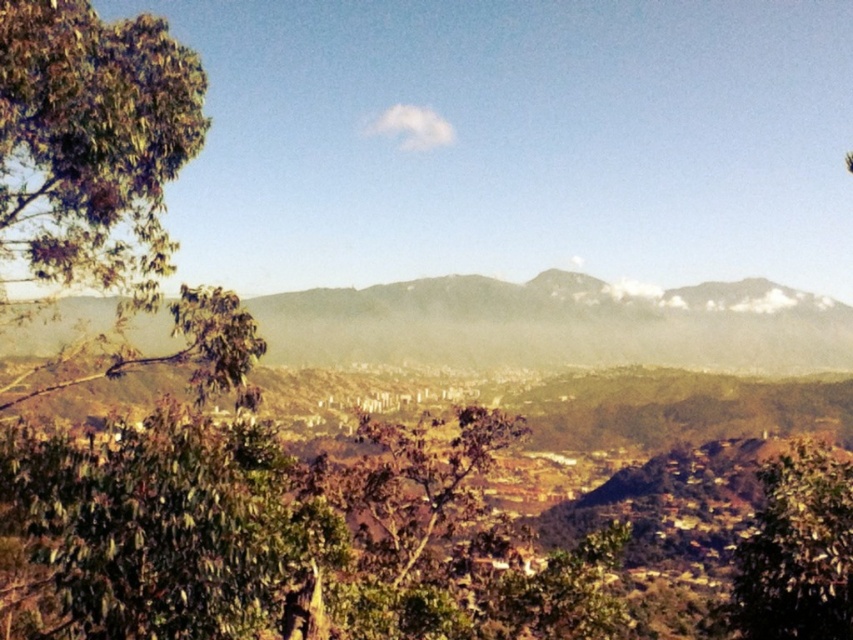
Between point (27, 113) and point (793, 336), which one is positioned in front?

Point (27, 113) is in front.

Is point (67, 64) farther from camera compared to point (685, 304)?

That is False.

In order to click on green leafy tree at left in this screenshot , I will do `click(91, 144)`.

Is green textured mountain at center to the right of green leafy tree at lower right from the viewer's perspective?

Indeed, green textured mountain at center is positioned on the right side of green leafy tree at lower right.

Based on the photo, which of these two, green textured mountain at center or green leafy tree at lower right, stands shorter?

Standing shorter between the two is green leafy tree at lower right.

Where is `green textured mountain at center`? The width and height of the screenshot is (853, 640). green textured mountain at center is located at coordinates (558, 324).

Where is `green textured mountain at center`? green textured mountain at center is located at coordinates (558, 324).

Which is in front, point (134, 156) or point (747, 536)?

Point (134, 156) is in front.

Locate an element on the screen. This screenshot has width=853, height=640. green leafy tree at left is located at coordinates (91, 144).